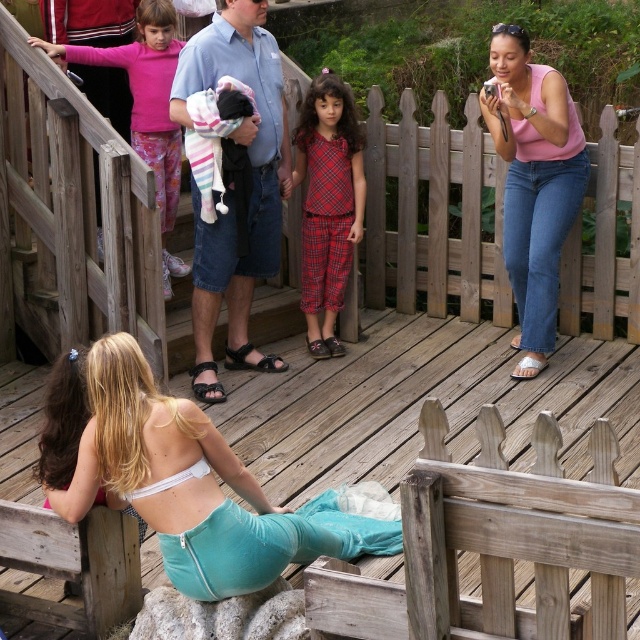
Is white fabric bikini top at lower left taller than pink cotton tank top at upper right?

No.

Which is more to the left, white fabric bikini top at lower left or pink cotton tank top at upper right?

white fabric bikini top at lower left is more to the left.

Does point (272, 548) come closer to viewer compared to point (544, 100)?

Yes, point (272, 548) is in front of point (544, 100).

Identify the location of white fabric bikini top at lower left. tap(195, 486).

Can you confirm if pink cotton tank top at upper right is smaller than plaid fabric pajamas at center?

Incorrect, pink cotton tank top at upper right is not smaller in size than plaid fabric pajamas at center.

Which of these two, pink cotton tank top at upper right or plaid fabric pajamas at center, stands taller?

pink cotton tank top at upper right

Is point (525, 99) positioned in front of point (321, 260)?

That is True.

Identify the location of pink cotton tank top at upper right. (532, 182).

What do you see at coordinates (326, 204) in the screenshot? The height and width of the screenshot is (640, 640). I see `plaid fabric pajamas at center` at bounding box center [326, 204].

Can you confirm if plaid fabric pajamas at center is positioned above pink fabric pants at upper left?

No.

The image size is (640, 640). I want to click on plaid fabric pajamas at center, so click(x=326, y=204).

Locate an element on the screen. The image size is (640, 640). plaid fabric pajamas at center is located at coordinates (326, 204).